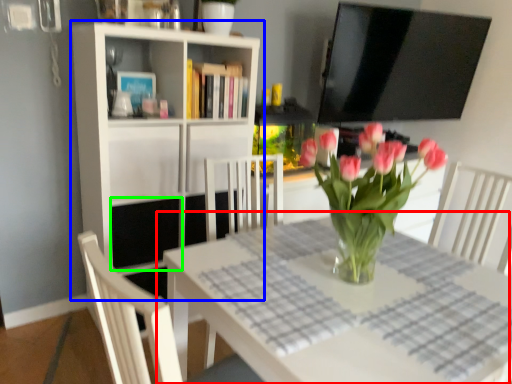
Question: Which object is positioned farthest from table (highlighted by a red box)? Select from shelf (highlighted by a blue box) and shelf (highlighted by a green box).

Choices:
 (A) shelf
 (B) shelf

Answer: (B)